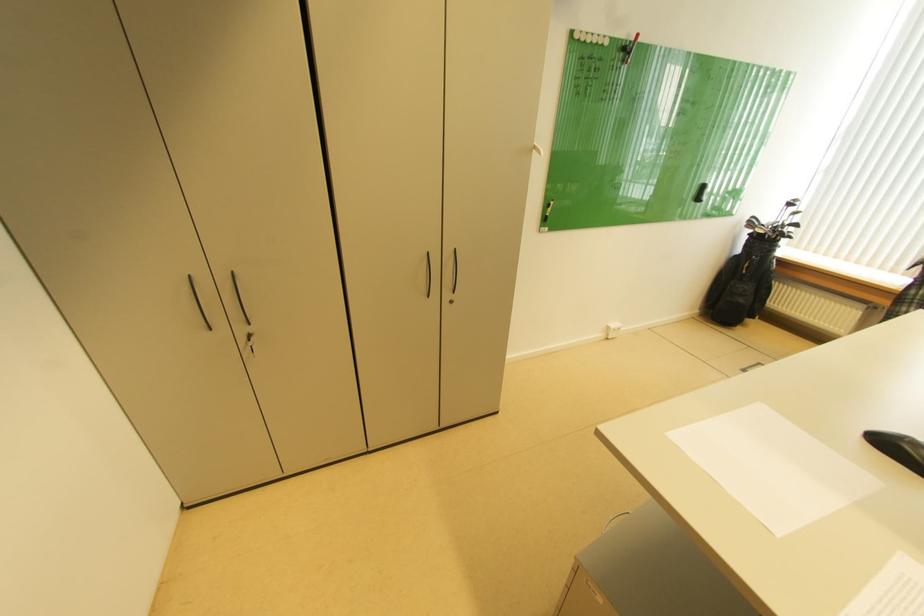
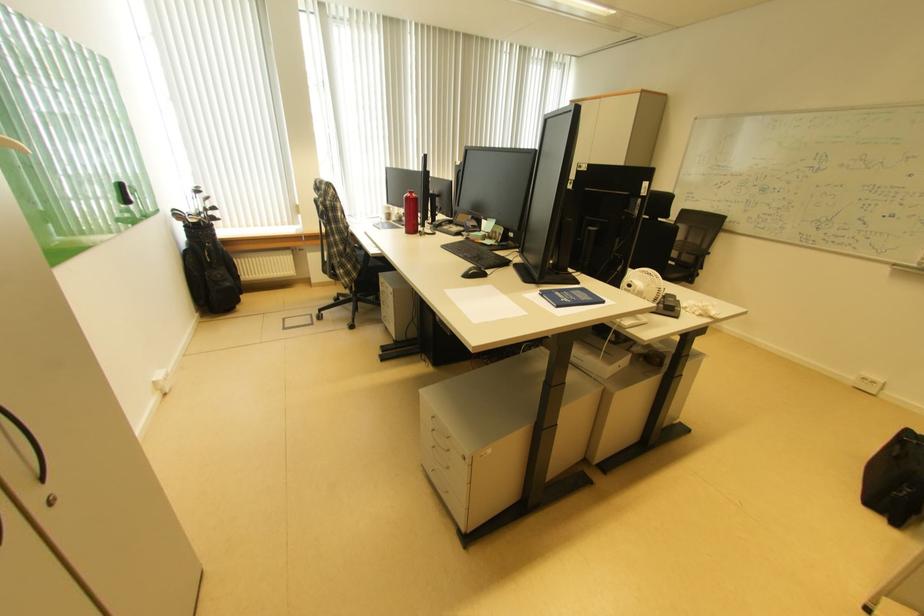
How did the camera likely rotate?

The camera rotated toward right-down.